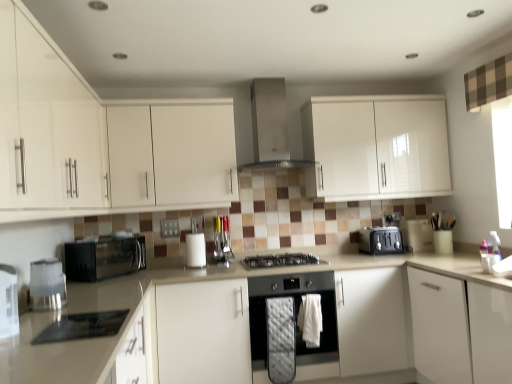
Question: Can you confirm if white plastic blender at lower left, arranged as the 2th appliance when viewed from the front, is bigger than satin silver toaster at right, which is counted as the 1th appliance, starting from the right?

Choices:
 (A) yes
 (B) no

Answer: (B)

Question: Is white plastic blender at lower left, marked as the fourth appliance in a back-to-front arrangement, at the right side of satin silver toaster at right, positioned as the fifth appliance in left-to-right order?

Choices:
 (A) yes
 (B) no

Answer: (B)

Question: From a real-world perspective, is white plastic blender at lower left, marked as the fourth appliance in a back-to-front arrangement, under satin silver toaster at right, which ranks as the 1th appliance in back-to-front order?

Choices:
 (A) yes
 (B) no

Answer: (B)

Question: Is white plastic blender at lower left, the 1th appliance positioned from the left, further to the viewer compared to satin silver toaster at right, which is counted as the 1th appliance, starting from the right?

Choices:
 (A) yes
 (B) no

Answer: (B)

Question: Can you confirm if white plastic blender at lower left, marked as the fourth appliance in a back-to-front arrangement, is shorter than satin silver toaster at right, which ranks as the 1th appliance in back-to-front order?

Choices:
 (A) no
 (B) yes

Answer: (A)

Question: Can you confirm if white plastic blender at lower left, the 1th appliance positioned from the left, is positioned to the left of satin silver toaster at right, which is counted as the 1th appliance, starting from the right?

Choices:
 (A) yes
 (B) no

Answer: (A)

Question: Does stainless steel oven at center, the third home appliance in the top-to-bottom sequence, have a smaller size compared to white plastic blender at lower left, arranged as the 2th appliance when viewed from the front?

Choices:
 (A) yes
 (B) no

Answer: (B)

Question: Is stainless steel oven at center, the 1th home appliance positioned from the bottom, to the right of white plastic blender at lower left, marked as the fourth appliance in a back-to-front arrangement, from the viewer's perspective?

Choices:
 (A) no
 (B) yes

Answer: (B)

Question: Is stainless steel oven at center, the 1th home appliance when ordered from right to left, oriented towards white plastic blender at lower left, marked as the fourth appliance in a back-to-front arrangement?

Choices:
 (A) no
 (B) yes

Answer: (A)

Question: Is stainless steel oven at center, the 1th home appliance positioned from the bottom, directly adjacent to white plastic blender at lower left, marked as the fourth appliance in a back-to-front arrangement?

Choices:
 (A) yes
 (B) no

Answer: (B)

Question: Is stainless steel oven at center, the third home appliance in the top-to-bottom sequence, far away from white plastic blender at lower left, arranged as the 2th appliance when viewed from the front?

Choices:
 (A) no
 (B) yes

Answer: (B)

Question: Is stainless steel oven at center, the 1th home appliance when ordered from right to left, in front of white plastic blender at lower left, the 1th appliance positioned from the left?

Choices:
 (A) yes
 (B) no

Answer: (B)

Question: Is white matte cabinet at upper left, the second cabinetry in the left-to-right sequence, in front of stainless steel oven at center, which appears as the 3th home appliance when viewed from the left?

Choices:
 (A) yes
 (B) no

Answer: (A)